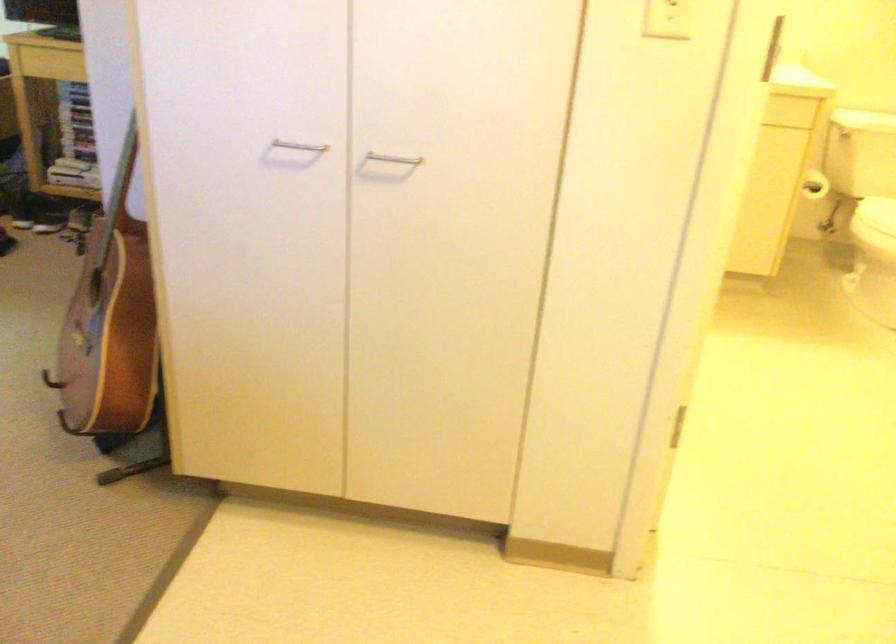
At what (x,y) coordinates should I click in order to perform the action: click on white toilet lid. Please return your answer as a coordinate pair (x, y). Looking at the image, I should click on (876, 214).